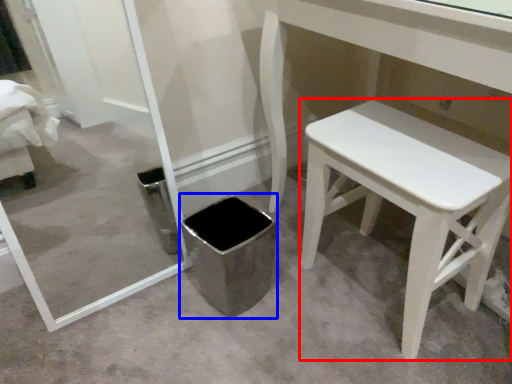
Question: Which of the following is the closest to the observer, stool (highlighted by a red box) or potty (highlighted by a blue box)?

Choices:
 (A) stool
 (B) potty

Answer: (A)